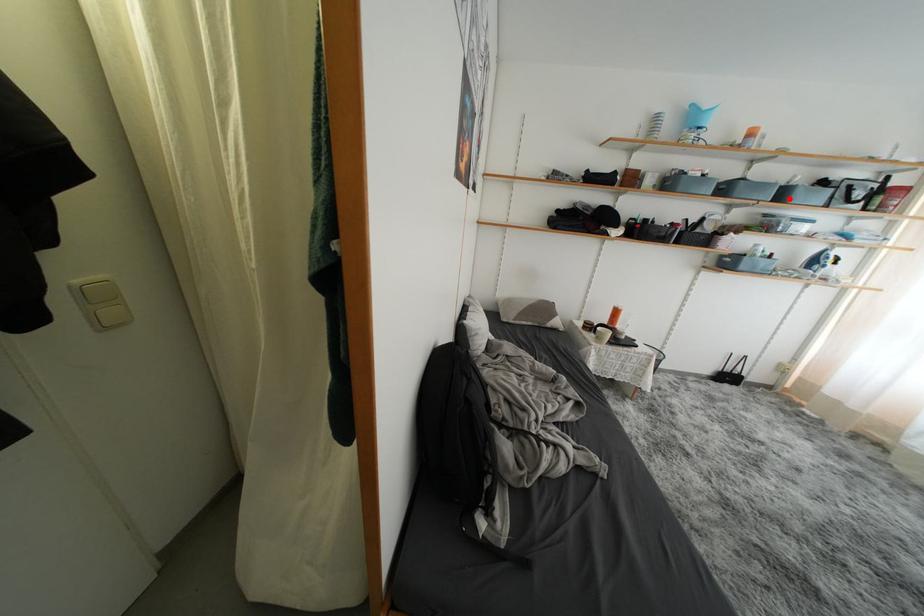
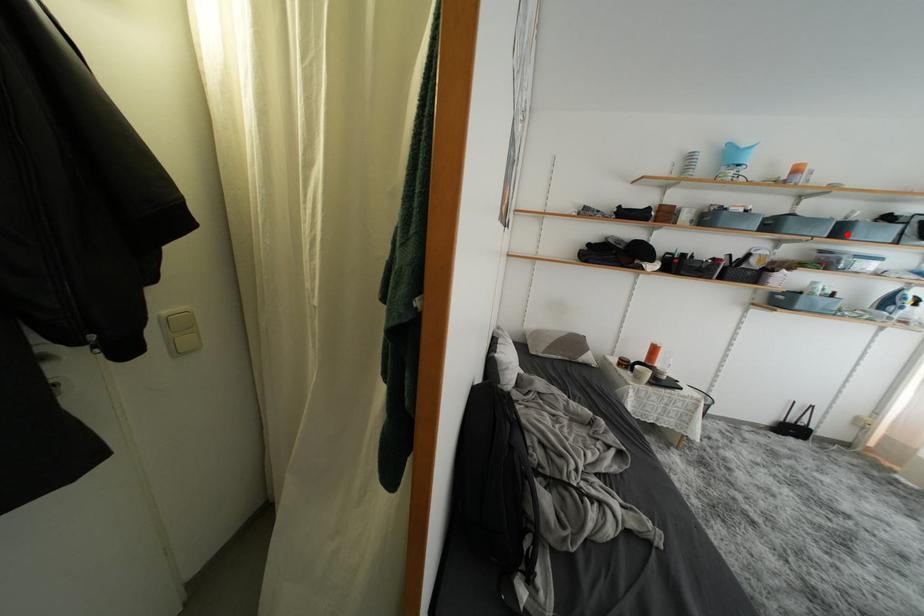
I am providing you with two images of the same scene from different viewpoints. A red point is marked on the first image and another point is marked on the second image. Does the point marked in image1 correspond to the same location as the one in image2?

Yes